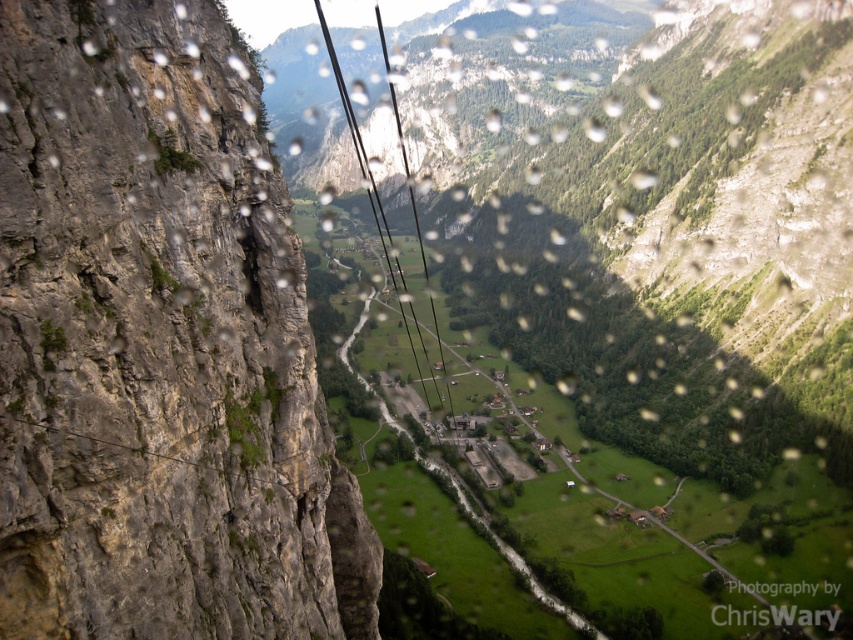
You are a passenger in a cable car and notice the rocky gray at left and the black wire at center. From your perspective inside the cable car, which object is positioned lower in the scene?

The rocky gray at left is located below the black wire at center, so it is positioned lower in the scene.

Based on the photo, you are a photographer trying to capture the valley below from the cable car. You notice the rocky gray at left and the black wire at center in your viewfinder. Which object appears narrower in the photo?

The rocky gray at left appears narrower than the black wire at center in the photo because it is thinner.

Based on the scene described, which object is located at the coordinates point [158,346]?

The point [158,346] corresponds to the rocky gray at left.